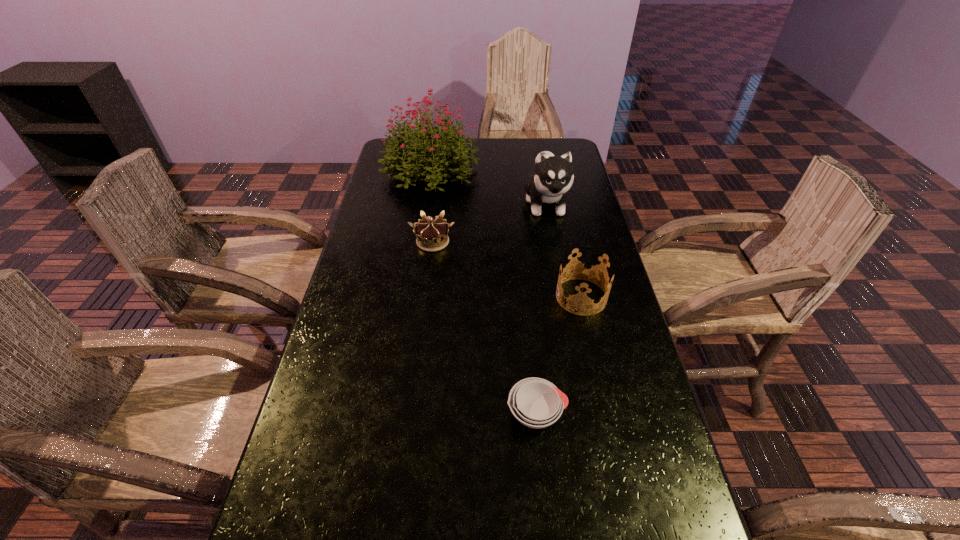
At what (x,y) coordinates should I click in order to perform the action: click on blank space at the far right corner of the desktop. Please return your answer as a coordinate pair (x, y). The height and width of the screenshot is (540, 960). Looking at the image, I should click on (538, 151).

Find the location of a particular element. The width and height of the screenshot is (960, 540). vacant space that is in between the fourth farthest object and the nearest object is located at coordinates (559, 355).

At what (x,y) coordinates should I click in order to perform the action: click on vacant space that is in between the puppy and the left crown. Please return your answer as a coordinate pair (x, y). This screenshot has width=960, height=540. Looking at the image, I should click on (490, 222).

This screenshot has width=960, height=540. Identify the location of empty space that is in between the left crown and the second tallest object. (490, 222).

In order to click on unoccupied area between the puppy and the shortest object in this screenshot , I will do `click(541, 308)`.

I want to click on vacant point located between the nearer crown and the bouquet, so click(506, 233).

This screenshot has width=960, height=540. I want to click on vacant area between the tallest object and the nearer crown, so click(506, 233).

What are the coordinates of `blank region between the puppy and the fourth farthest object` in the screenshot? It's located at (564, 250).

Find the location of a particular element. This screenshot has width=960, height=540. vacant space that is in between the shortest object and the fourth tallest object is located at coordinates (485, 327).

Find the location of a particular element. The height and width of the screenshot is (540, 960). free point between the shortest object and the nearer crown is located at coordinates (559, 355).